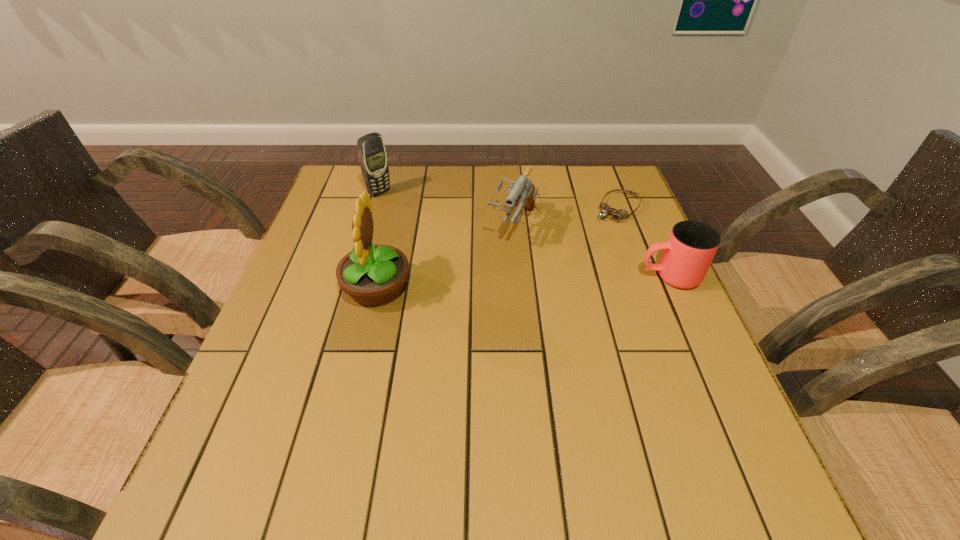
Identify the location of vacant space located 0.330m on the handle side of the second shortest object. Image resolution: width=960 pixels, height=540 pixels. (498, 276).

Where is `free spot located 0.070m on the handle side of the second shortest object`? This screenshot has height=540, width=960. free spot located 0.070m on the handle side of the second shortest object is located at coordinates (609, 276).

I want to click on vacant space located on the front lenses and sides of the shortest object, so click(x=565, y=276).

Find the location of a particular element. vacant area situated 0.080m on the front lenses and sides of the shortest object is located at coordinates click(596, 237).

Find the location of a particular element. The height and width of the screenshot is (540, 960). vacant region located on the front lenses and sides of the shortest object is located at coordinates (573, 267).

Where is `vacant area located at the barrel end of the third shortest object`? vacant area located at the barrel end of the third shortest object is located at coordinates (456, 346).

Identify the location of free location located 0.380m at the barrel end of the third shortest object. (444, 369).

Find the location of a particular element. The height and width of the screenshot is (540, 960). free region located at the barrel end of the third shortest object is located at coordinates (460, 339).

Where is `free space located 0.170m on the front face of the cellular telephone`? free space located 0.170m on the front face of the cellular telephone is located at coordinates (423, 223).

Locate an element on the screen. Image resolution: width=960 pixels, height=540 pixels. free space located on the front face of the cellular telephone is located at coordinates (410, 214).